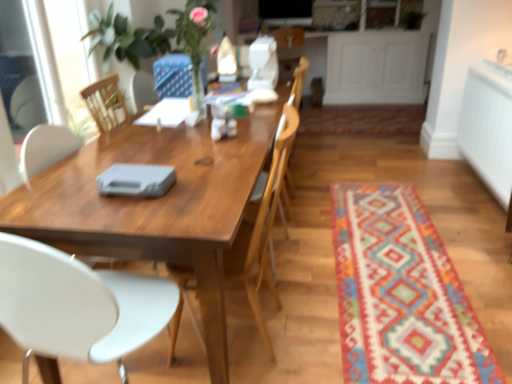
This screenshot has height=384, width=512. Identify the location of free space to the right of wooden table at center. (378, 177).